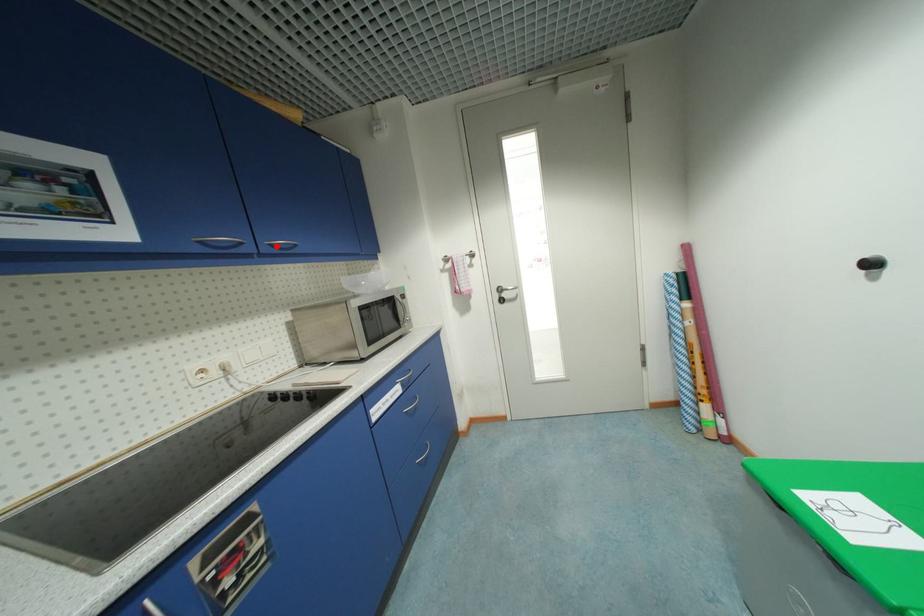
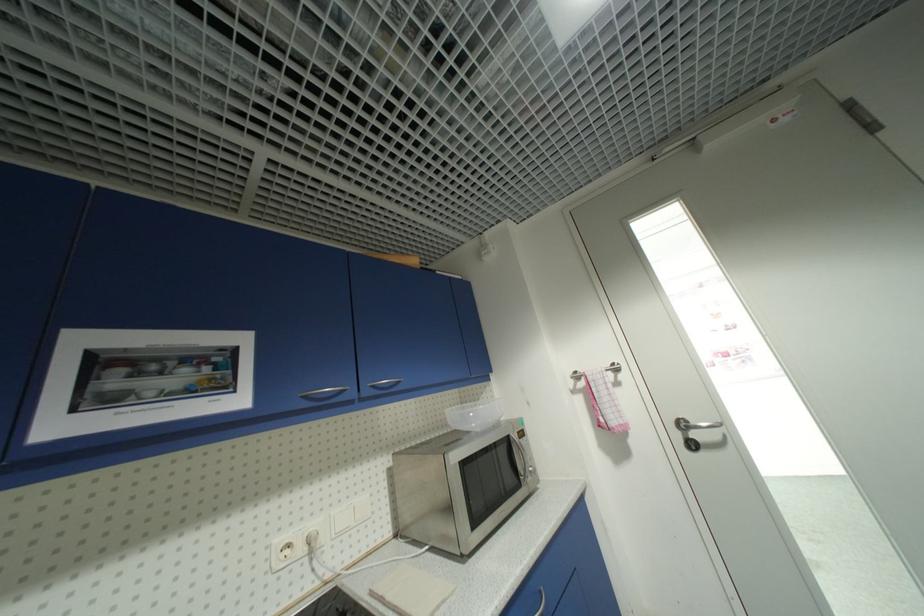
Where in the second image is the point corresponding to the highlighted location from the first image?

(379, 387)